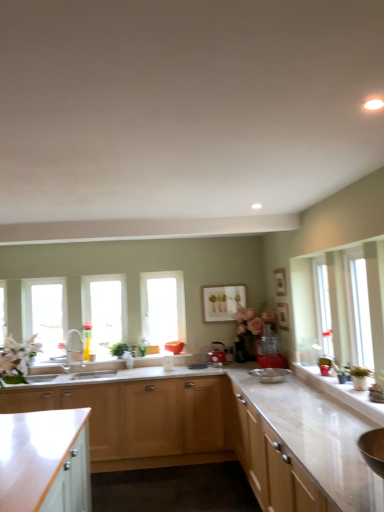
I want to click on unoccupied region to the right of metallic red kettle at center, which is the first appliance in left-to-right order, so click(x=232, y=367).